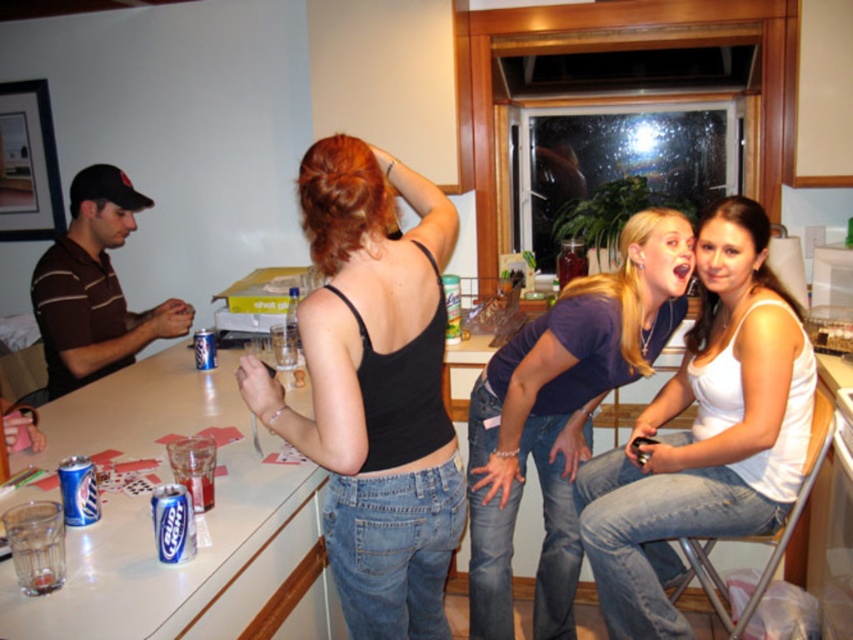
Does point (50, 540) lie in front of point (178, 554)?

Yes, it is.

Is transparent glass at lower left closer to camera compared to blue metallic can at lower left?

Yes.

Describe the element at coordinates (36, 545) in the screenshot. I see `transparent glass at lower left` at that location.

Identify the location of transparent glass at lower left. (36, 545).

Based on the photo, does white matte tank top at center have a smaller size compared to dark purple t-shirt at center?

Yes, white matte tank top at center is smaller than dark purple t-shirt at center.

Can you confirm if white matte tank top at center is shorter than dark purple t-shirt at center?

Indeed, white matte tank top at center has a lesser height compared to dark purple t-shirt at center.

Is point (711, 378) farther from viewer compared to point (561, 301)?

No, it is in front of (561, 301).

This screenshot has width=853, height=640. What are the coordinates of `white matte tank top at center` in the screenshot? It's located at (704, 433).

Between point (361, 608) and point (128, 320), which one is positioned behind?

Positioned behind is point (128, 320).

Which is below, black matte tank top at center or brown striped shirt at left?

black matte tank top at center

The image size is (853, 640). I want to click on black matte tank top at center, so click(374, 388).

You are a GUI agent. You are given a task and a screenshot of the screen. Output one action in this format:
    pyautogui.click(x=<x>, y=<y>)
    Task: Click on the black matte tank top at center
    The width and height of the screenshot is (853, 640).
    Given the screenshot: What is the action you would take?
    pyautogui.click(x=374, y=388)